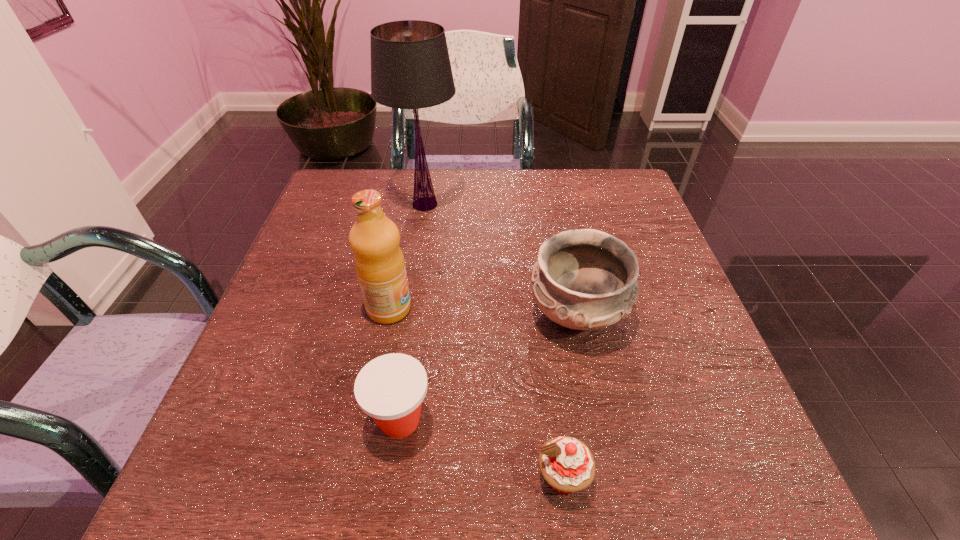
At what (x,y) coordinates should I click in order to perform the action: click on object that stands as the closest to the pottery. Please return your answer as a coordinate pair (x, y). Looking at the image, I should click on (566, 463).

This screenshot has height=540, width=960. What are the coordinates of `free location that satisfies the following two spatial constraints: 1. on the back side of the Dixie cup; 2. on the front-facing side of the lampshade` in the screenshot? It's located at (430, 204).

I want to click on free space that satisfies the following two spatial constraints: 1. on the front-facing side of the Dixie cup; 2. on the left side of the farthest object, so click(x=392, y=420).

Where is `free location that satisfies the following two spatial constraints: 1. on the front label of the cupcake; 2. on the left side of the second tallest object`? The width and height of the screenshot is (960, 540). free location that satisfies the following two spatial constraints: 1. on the front label of the cupcake; 2. on the left side of the second tallest object is located at coordinates (356, 477).

This screenshot has width=960, height=540. I want to click on vacant region that satisfies the following two spatial constraints: 1. on the back side of the pottery; 2. on the front label of the fruit juice, so click(575, 308).

Find the location of a particular element. The height and width of the screenshot is (540, 960). free point that satisfies the following two spatial constraints: 1. on the front label of the fruit juice; 2. on the left side of the third tallest object is located at coordinates (388, 314).

What are the coordinates of `free space that satisfies the following two spatial constraints: 1. on the front label of the fourth shortest object; 2. on the right side of the cupcake` in the screenshot? It's located at (356, 477).

What are the coordinates of `free space that satisfies the following two spatial constraints: 1. on the front-facing side of the Dixie cup; 2. on the right side of the lampshade` in the screenshot? It's located at (392, 420).

Where is `free spot that satisfies the following two spatial constraints: 1. on the front-facing side of the tallest object; 2. on the back side of the pottery`? This screenshot has width=960, height=540. free spot that satisfies the following two spatial constraints: 1. on the front-facing side of the tallest object; 2. on the back side of the pottery is located at coordinates (408, 314).

The width and height of the screenshot is (960, 540). In order to click on blank area in the image that satisfies the following two spatial constraints: 1. on the front side of the Dixie cup; 2. on the left side of the cupcake in this screenshot , I will do `click(392, 477)`.